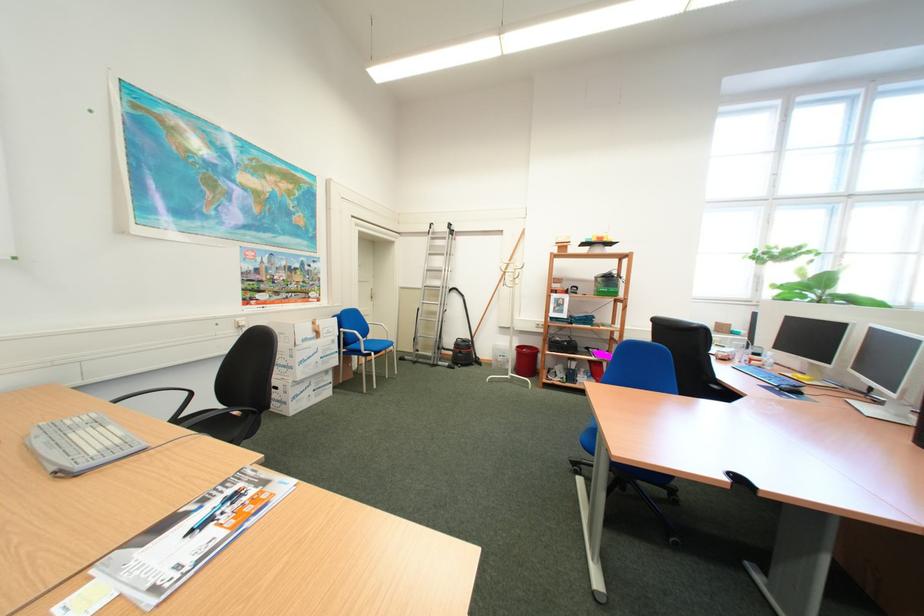
This screenshot has height=616, width=924. Identify the location of white door handle. (371, 296).